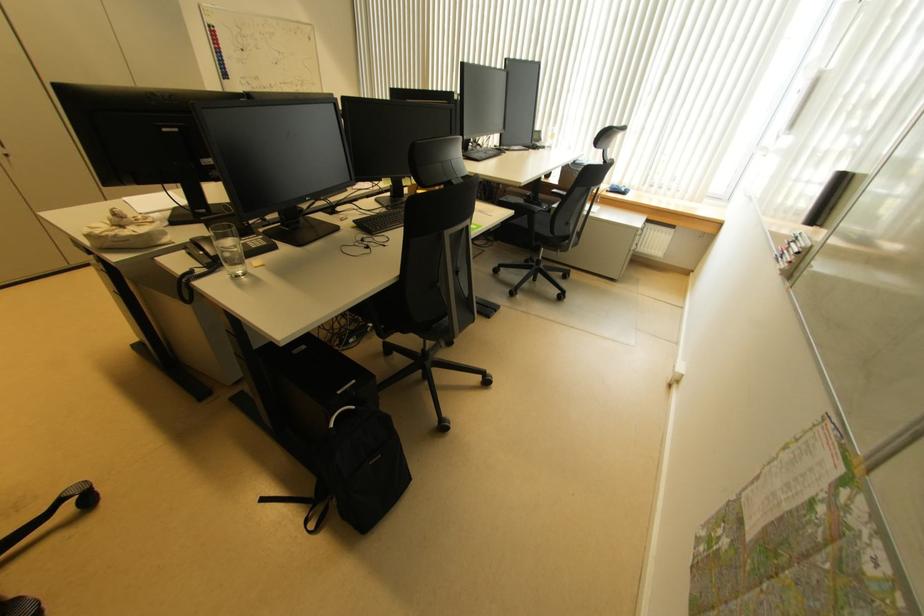
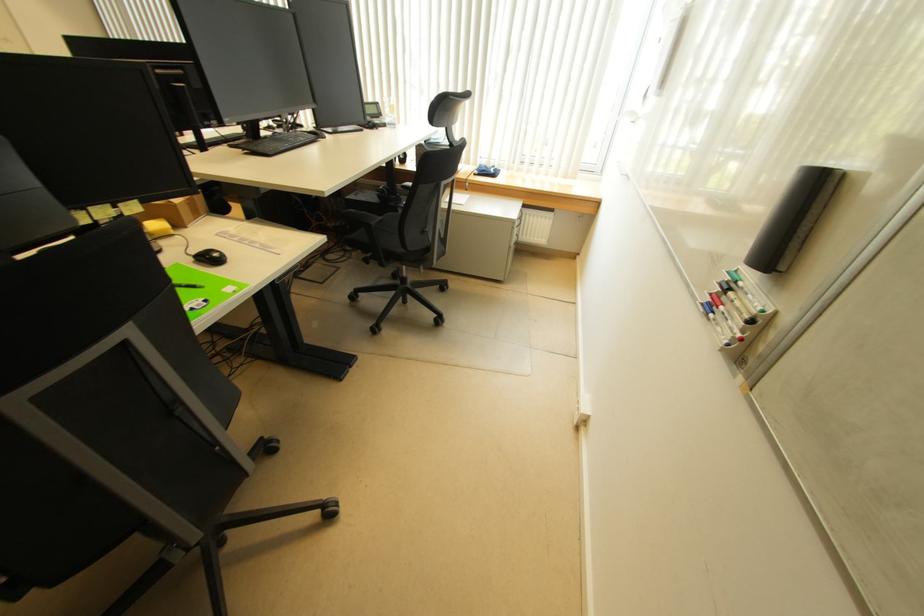
The point at [545,148] is marked in the first image. Where is the corresponding point in the second image?

(386, 124)